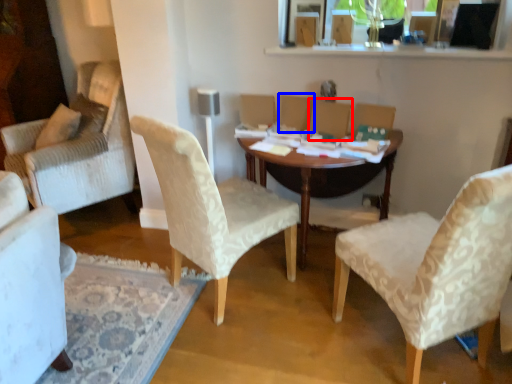
Question: Which of the following is the farthest to the observer, armchair (highlighted by a red box) or armchair (highlighted by a blue box)?

Choices:
 (A) armchair
 (B) armchair

Answer: (B)